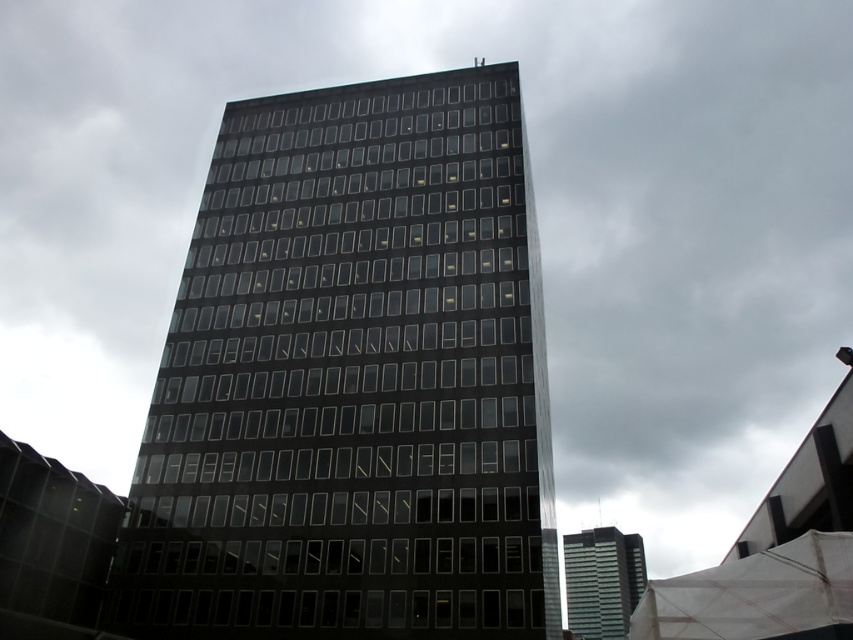
You are an architect evaluating two buildings in the city. You see the black glass building at center and the glassy reflective skyscraper at center. Which building is taller?

The black glass building at center is taller than the glassy reflective skyscraper at center according to the description.

You are standing in front of the black glass building at center and the glassy reflective skyscraper at center. Which one appears taller when viewed from the ground?

The black glass building at center appears taller because it is positioned over the glassy reflective skyscraper at center, making it look larger from the ground perspective.

You are standing in a park across the street from the black glass building at center. You want to take a photo of the building but need to stay at least 120 feet away to avoid a restricted area. Is your current position within the restricted area?

The black glass building at center is 116.57 feet away from you. Since 116.57 feet is less than 120 feet, you are currently within the restricted area and need to move further back to comply with the 120 feet requirement.